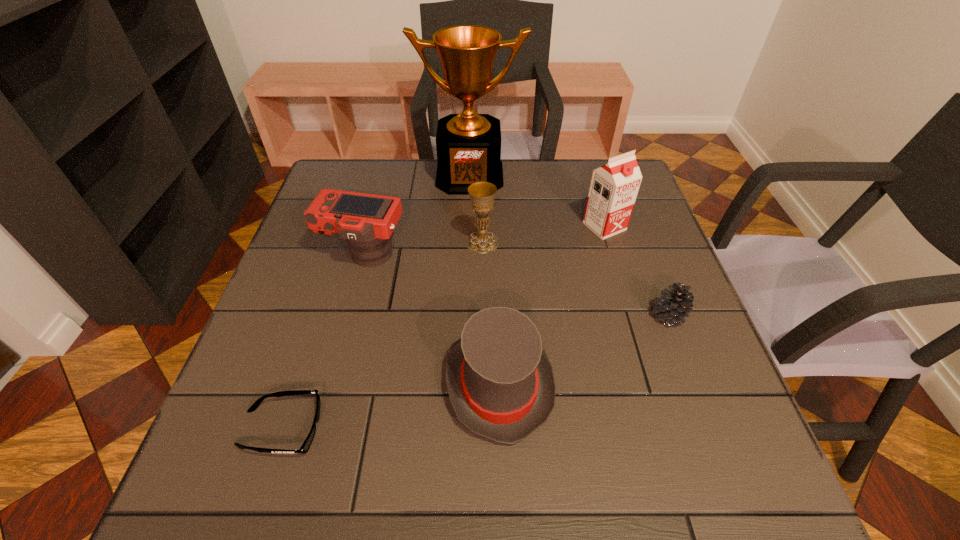
At what (x,y) coordinates should I click in order to perform the action: click on soya milk at the right edge. Please return your answer as a coordinate pair (x, y). This screenshot has height=540, width=960. Looking at the image, I should click on (614, 186).

You are a GUI agent. You are given a task and a screenshot of the screen. Output one action in this format:
    pyautogui.click(x=<x>, y=<y>)
    Task: Click on the pinecone positioned at the right edge
    This screenshot has width=960, height=540.
    Given the screenshot: What is the action you would take?
    pyautogui.click(x=674, y=305)

Image resolution: width=960 pixels, height=540 pixels. I want to click on object located at the near left corner, so click(304, 448).

Image resolution: width=960 pixels, height=540 pixels. In the image, there is a desktop. What are the coordinates of `vacant space at the far edge` in the screenshot? It's located at (544, 197).

Identify the location of vacant space at the near edge. (622, 502).

I want to click on blank space at the left edge, so point(265,369).

Locate an element on the screen. The height and width of the screenshot is (540, 960). free spot at the right edge of the desktop is located at coordinates (682, 431).

Image resolution: width=960 pixels, height=540 pixels. I want to click on free space at the near left corner of the desktop, so click(x=246, y=470).

At what (x,y) coordinates should I click in order to perform the action: click on vacant space in between the soya milk and the dress hat. Please return your answer as a coordinate pair (x, y). Looking at the image, I should click on (552, 306).

The width and height of the screenshot is (960, 540). I want to click on vacant area that lies between the dress hat and the sixth tallest object, so click(x=584, y=351).